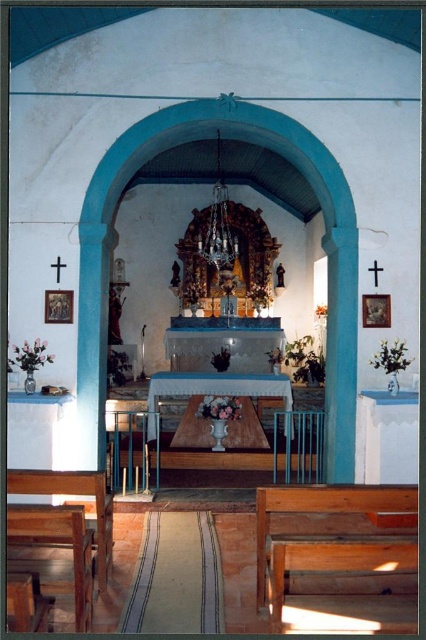
Is wooden bench at lower right above wooden bench at lower left?

Indeed, wooden bench at lower right is positioned over wooden bench at lower left.

Looking at this image, is wooden bench at lower right thinner than wooden bench at lower left?

Incorrect, wooden bench at lower right's width is not less than wooden bench at lower left's.

Measure the distance between wooden bench at lower right and camera.

wooden bench at lower right and camera are 7.73 feet apart from each other.

Find the location of a particular element. wooden bench at lower right is located at coordinates (331, 536).